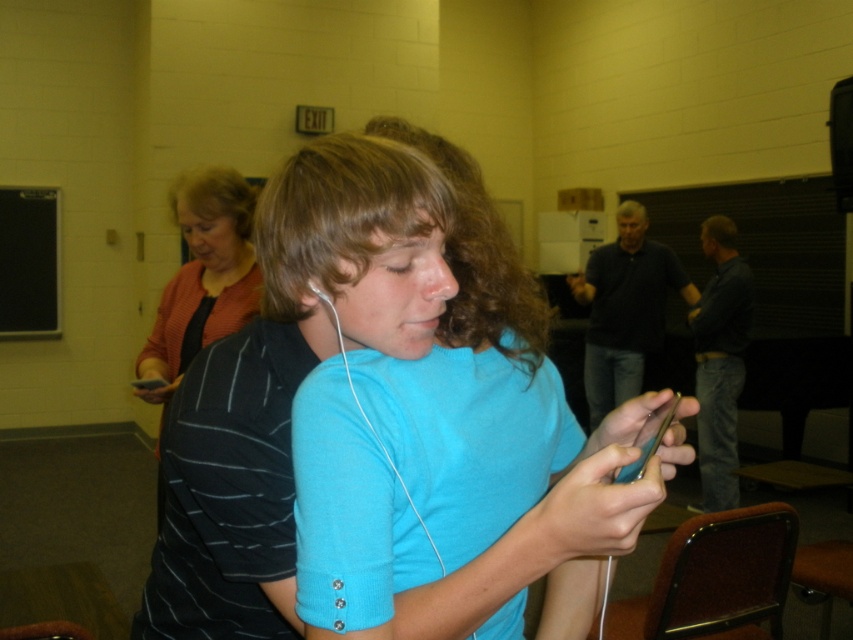
Question: Estimate the real-world distances between objects in this image. Which object is farther from the blue matte shirt at center?

Choices:
 (A) dark brown curly hair at upper center
 (B) light brown curly hair at center
 (C) dark blue shirt at right

Answer: (A)

Question: Is light brown curly hair at center to the right of blonde hair at upper center from the viewer's perspective?

Choices:
 (A) no
 (B) yes

Answer: (B)

Question: Which object is closer to the camera taking this photo?

Choices:
 (A) blue matte shirt at center
 (B) brown curly hair at upper center
 (C) dark blue shirt at right

Answer: (A)

Question: Among these points, which one is nearest to the camera?

Choices:
 (A) (706, 403)
 (B) (345, 452)
 (C) (694, 294)
 (D) (625, 216)

Answer: (B)

Question: Does blue matte shirt at center appear on the right side of dark blue sweater at center?

Choices:
 (A) no
 (B) yes

Answer: (A)

Question: Is dark blue shirt at right thinner than blonde hair at upper center?

Choices:
 (A) yes
 (B) no

Answer: (A)